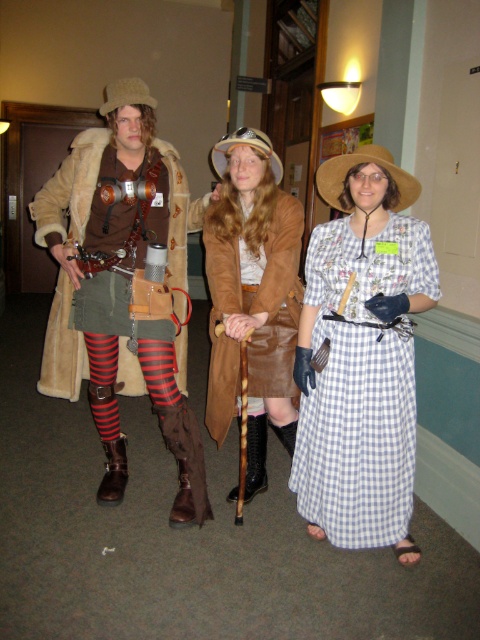
Between striped wool tights at center and white checkered fabric dress at center, which one appears on the right side from the viewer's perspective?

From the viewer's perspective, white checkered fabric dress at center appears more on the right side.

I want to click on striped wool tights at center, so [x=123, y=285].

Which is behind, point (332, 444) or point (300, 220)?

The point (300, 220) is behind.

What are the coordinates of `white checkered fabric dress at center` in the screenshot? It's located at (360, 385).

Is striped wool tights at center to the right of brown suede coat at center from the viewer's perspective?

In fact, striped wool tights at center is to the left of brown suede coat at center.

Does point (130, 214) come in front of point (235, 138)?

No, (130, 214) is further to viewer.

This screenshot has width=480, height=640. What are the coordinates of `striped wool tights at center` in the screenshot? It's located at pos(123,285).